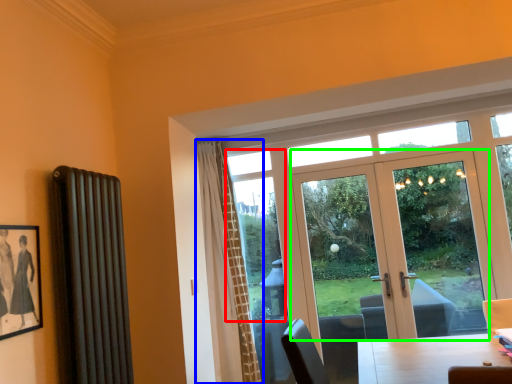
Question: Which is farther away from window screen (highlighted by a red box)? curtain (highlighted by a blue box) or door (highlighted by a green box)?

Choices:
 (A) curtain
 (B) door

Answer: (B)